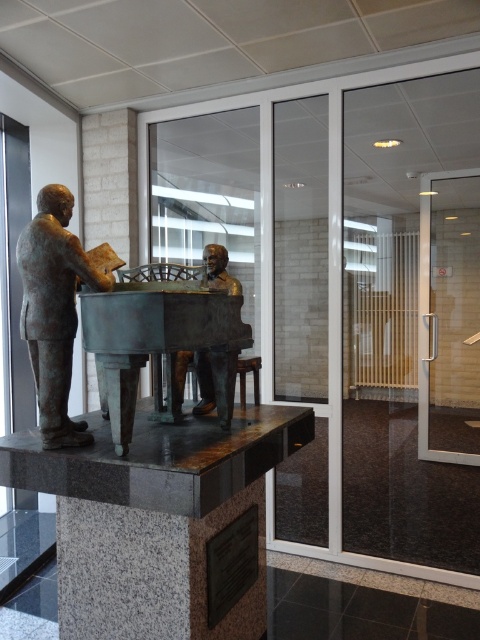
Question: Estimate the real-world distances between objects in this image. Which object is closer to the bronze polished piano at center?

Choices:
 (A) bronze bust at center
 (B) bronze statue at left

Answer: (B)

Question: Which of the following is the closest to the observer?

Choices:
 (A) bronze bust at center
 (B) bronze statue at left

Answer: (B)

Question: Can you confirm if bronze statue at left is positioned above bronze bust at center?

Choices:
 (A) yes
 (B) no

Answer: (A)

Question: Where is bronze statue at left located in relation to bronze bust at center in the image?

Choices:
 (A) above
 (B) below

Answer: (A)

Question: Which object appears closest to the camera in this image?

Choices:
 (A) bronze bust at center
 (B) bronze polished piano at center

Answer: (B)

Question: Observing the image, what is the correct spatial positioning of bronze statue at left in reference to bronze bust at center?

Choices:
 (A) above
 (B) below

Answer: (A)